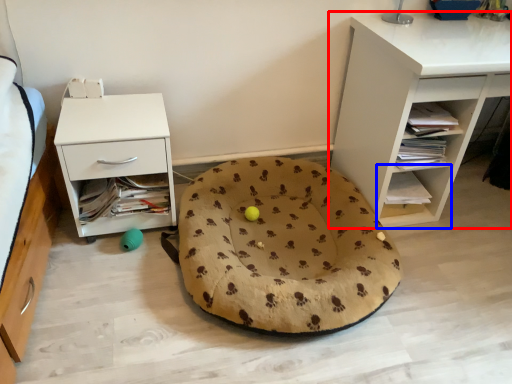
Question: Which point is closer to the camera, shelf (highlighted by a red box) or shelf (highlighted by a blue box)?

Choices:
 (A) shelf
 (B) shelf

Answer: (A)